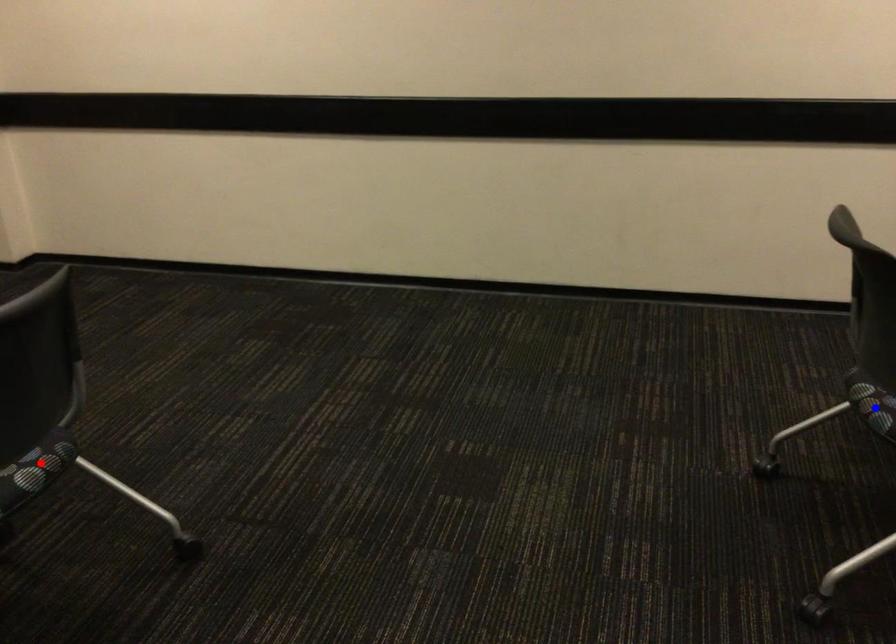
Question: Two points are marked on the image. Which point is closer to the camera?

Choices:
 (A) Blue point is closer.
 (B) Red point is closer.

Answer: (B)